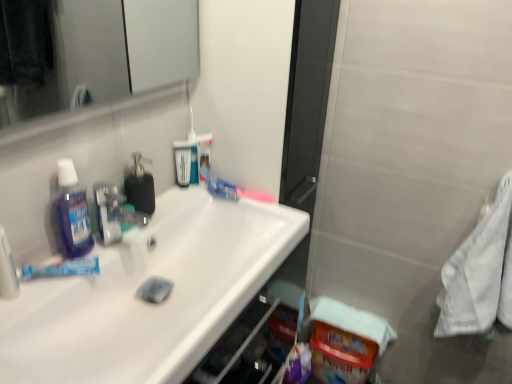
Locate an element on the screen. The image size is (512, 384). vacant region in front of blue glossy mouthwash at upper center, the 2th mouthwash viewed from the right is located at coordinates (173, 205).